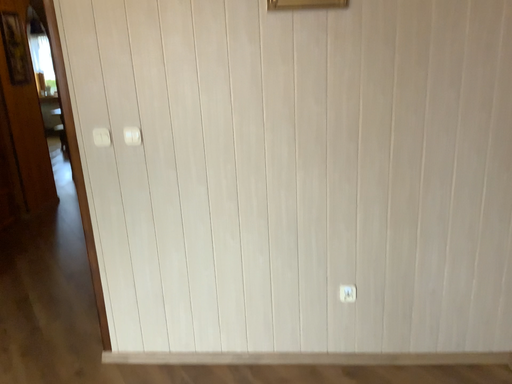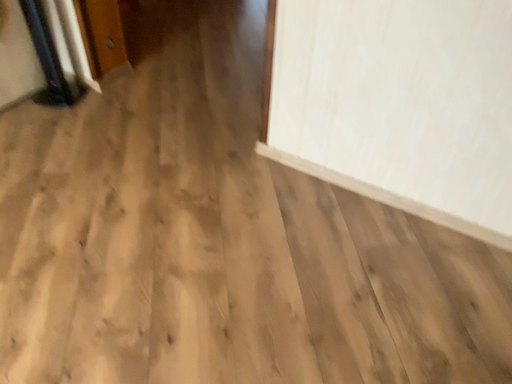
Question: How did the camera likely rotate when shooting the video?

Choices:
 (A) rotated downward
 (B) rotated upward

Answer: (A)